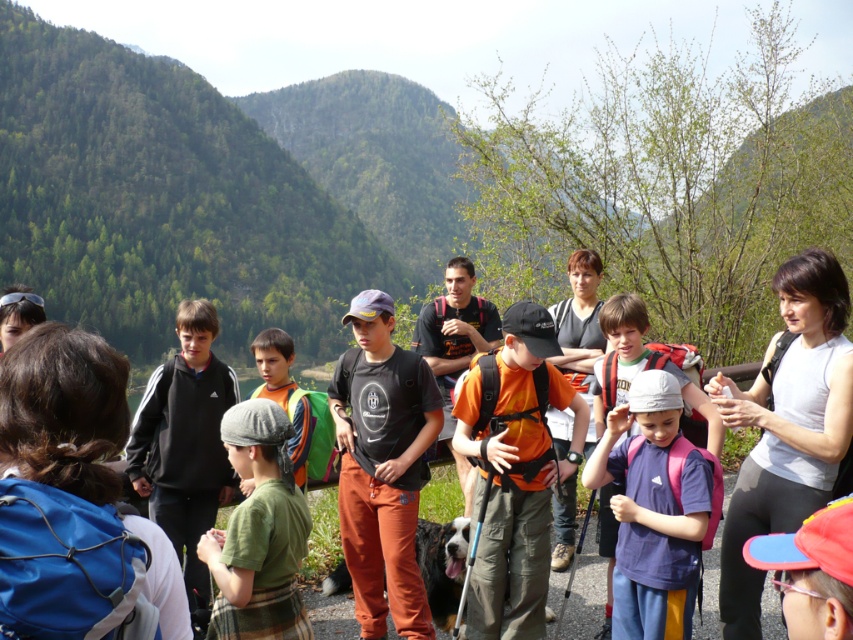
Does green forested mountain at center have a greater width compared to green cotton shirt at center?

Yes.

Between green forested mountain at center and green cotton shirt at center, which one is positioned higher?

green forested mountain at center is above.

Is point (286, 237) more distant than point (276, 561)?

Yes, point (286, 237) is farther from viewer.

You are a GUI agent. You are given a task and a screenshot of the screen. Output one action in this format:
    pyautogui.click(x=<x>, y=<y>)
    Task: Click on the green forested mountain at center
    Image resolution: width=853 pixels, height=640 pixels.
    Given the screenshot: What is the action you would take?
    pyautogui.click(x=410, y=189)

Does green forested mountain at center have a lesser height compared to purple matte shirt at center?

No, green forested mountain at center is not shorter than purple matte shirt at center.

Does green forested mountain at center have a greater width compared to purple matte shirt at center?

Yes, green forested mountain at center is wider than purple matte shirt at center.

This screenshot has height=640, width=853. What are the coordinates of `green forested mountain at center` in the screenshot? It's located at (410, 189).

This screenshot has height=640, width=853. Identify the location of green forested mountain at center. (410, 189).

Who is more forward, (328, 168) or (276, 388)?

Point (276, 388) is more forward.

From the picture: Is green forested mountain at center below orange fabric backpack at center?

No, green forested mountain at center is not below orange fabric backpack at center.

From the picture: Who is more forward, (260, 280) or (323, 465)?

Point (323, 465)

Find the location of a particular element. The height and width of the screenshot is (640, 853). green forested mountain at center is located at coordinates (410, 189).